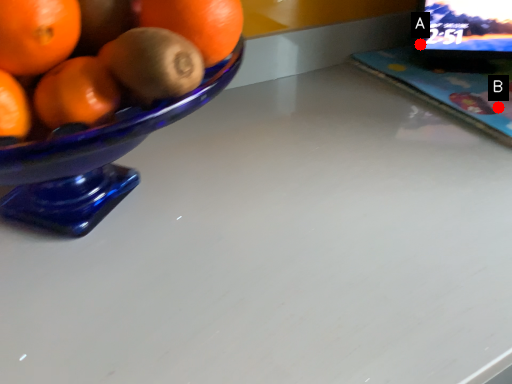
Question: Two points are circled on the image, labeled by A and B beside each circle. Which point appears farthest from the camera in this image?

Choices:
 (A) A is further
 (B) B is further

Answer: (A)